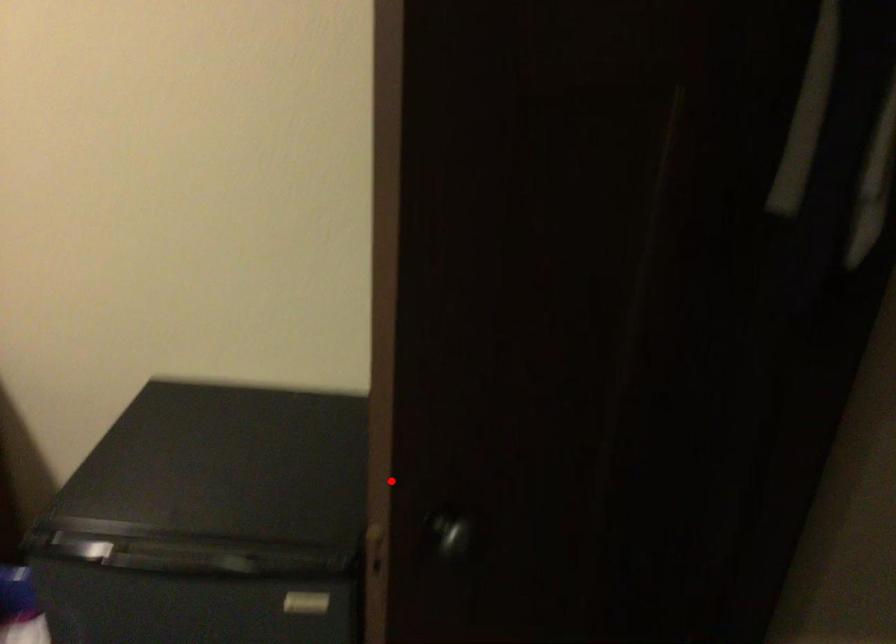
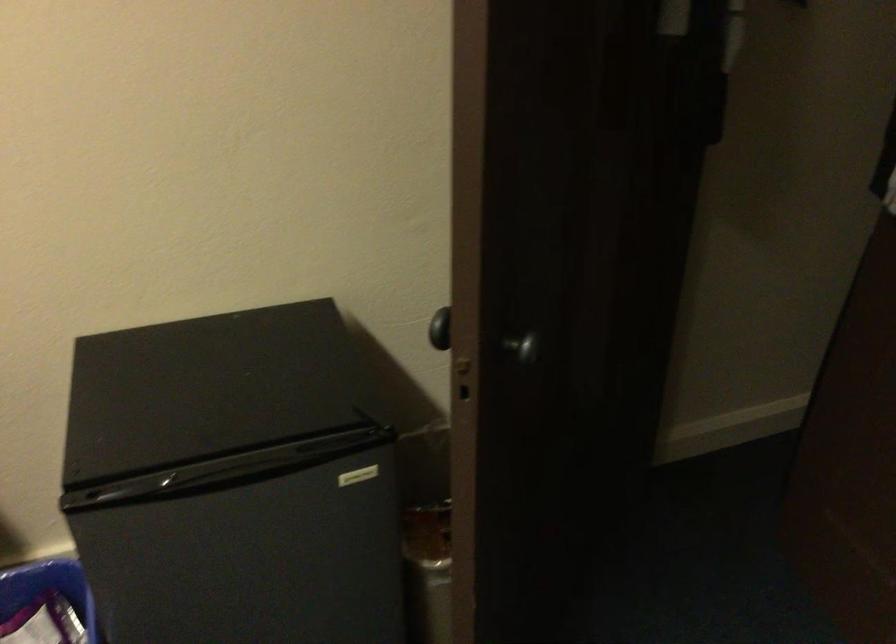
Question: I am providing you with two images of the same scene from different viewpoints. Given a red point in image1, look at the same physical point in image2. Is it:

Choices:
 (A) Closer to the viewpoint
 (B) Farther from the viewpoint

Answer: (B)